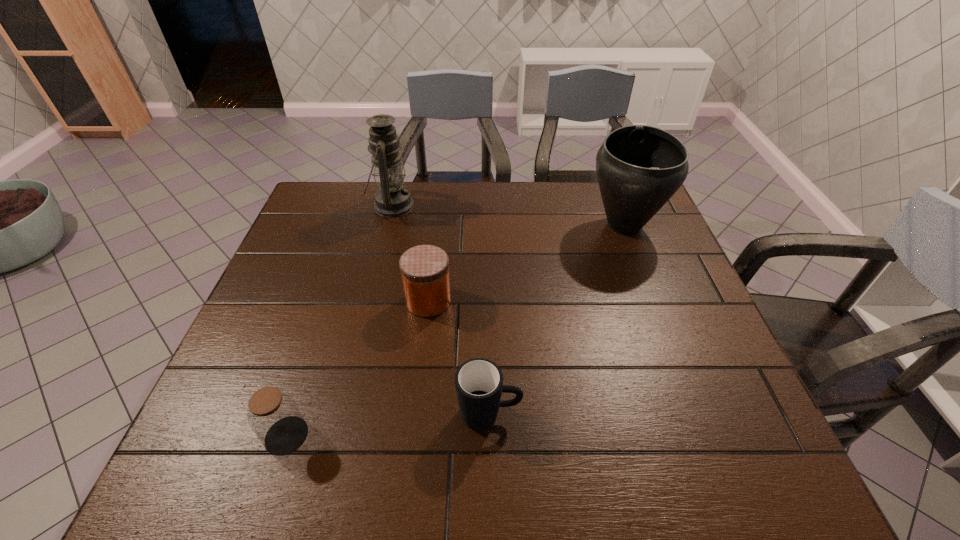
The image size is (960, 540). I want to click on vacant space located on the back of the left jar, so click(x=315, y=349).

Identify the location of oil lamp that is at the far edge. The height and width of the screenshot is (540, 960). (392, 199).

Find the location of a particular element. The height and width of the screenshot is (540, 960). urn present at the far edge is located at coordinates point(639,168).

What are the coordinates of `object that is at the near edge` in the screenshot? It's located at (273, 415).

The width and height of the screenshot is (960, 540). Identify the location of object that is positioned at the left edge. (273, 415).

Where is `object situated at the right edge`? object situated at the right edge is located at coordinates (639, 168).

At what (x,y) coordinates should I click in order to perform the action: click on object that is at the near left corner. Please return your answer as a coordinate pair (x, y). Looking at the image, I should click on coord(273,415).

Find the location of a particular element. The image size is (960, 540). object situated at the far right corner is located at coordinates [639, 168].

Find the location of a particular element. This screenshot has width=960, height=540. free location at the far edge of the desktop is located at coordinates [585, 182].

The image size is (960, 540). Find the location of `vacant position at the near edge of the desktop`. vacant position at the near edge of the desktop is located at coordinates (331, 471).